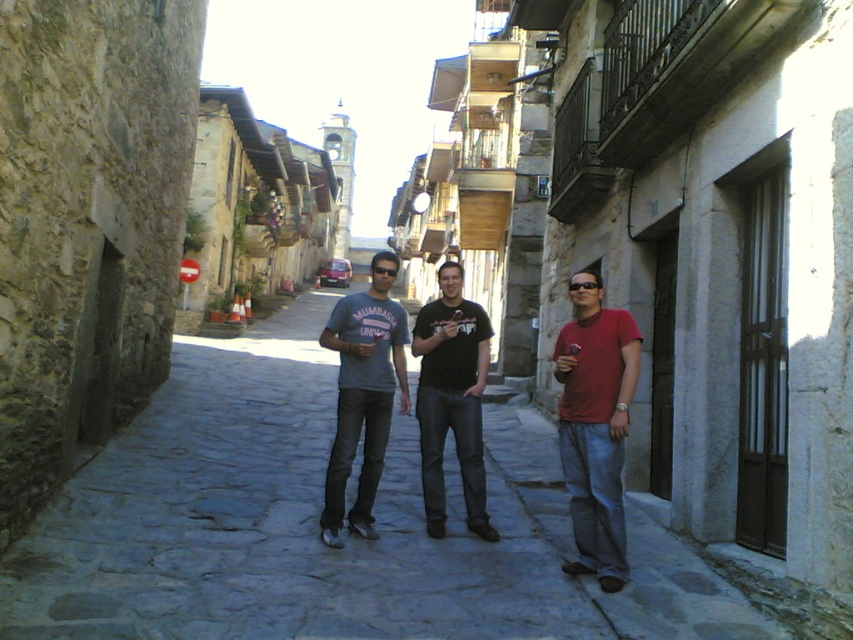
Who is positioned more to the right, gray cobblestone pavement at center or matte gray t-shirt at center?

matte gray t-shirt at center

Is point (160, 486) in front of point (381, 314)?

No.

Which is behind, point (146, 536) or point (376, 253)?

The point (376, 253) is more distant.

The height and width of the screenshot is (640, 853). I want to click on gray cobblestone pavement at center, so click(316, 525).

How much distance is there between matte red shirt at right and matte gray t-shirt at center?

matte red shirt at right is 4.59 feet away from matte gray t-shirt at center.

Can you confirm if matte red shirt at right is positioned to the left of matte gray t-shirt at center?

No, matte red shirt at right is not to the left of matte gray t-shirt at center.

Between point (582, 346) and point (381, 332), which one is positioned in front?

Point (582, 346) is in front.

This screenshot has height=640, width=853. What are the coordinates of `matte red shirt at right` in the screenshot? It's located at (595, 426).

Can you confirm if matte red shirt at right is positioned above black cotton t-shirt at center?

Yes, matte red shirt at right is above black cotton t-shirt at center.

Which is in front, point (567, 442) or point (468, 481)?

Point (567, 442)

Identify the location of matte red shirt at right. Image resolution: width=853 pixels, height=640 pixels. (595, 426).